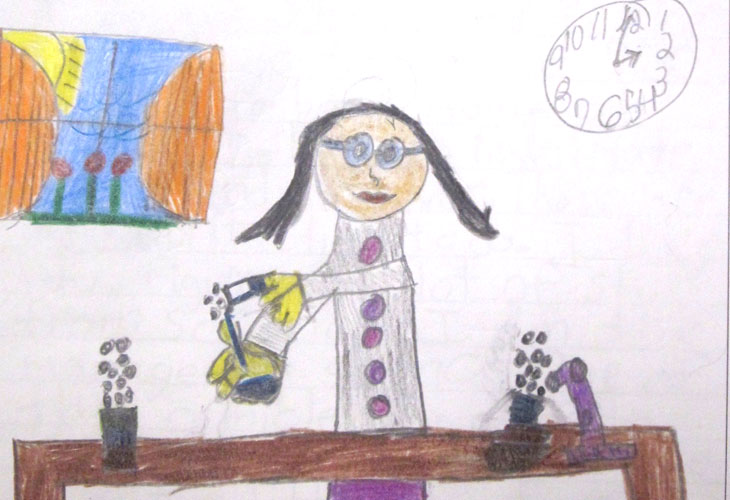
This screenshot has height=500, width=730. Find the location of `small hand - clock`. small hand - clock is located at coordinates (631, 62).